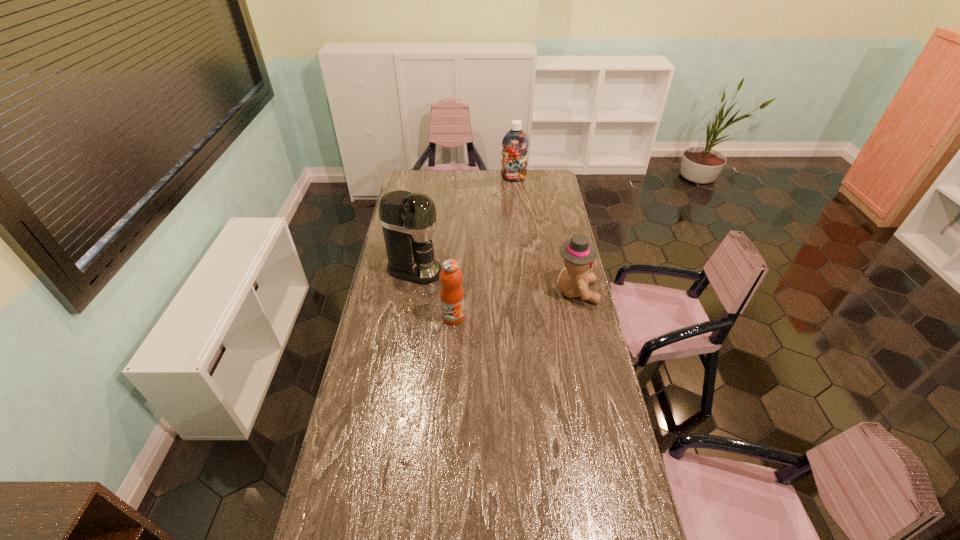
The width and height of the screenshot is (960, 540). Find the location of `object that is the second closest to the leftmost object`. object that is the second closest to the leftmost object is located at coordinates (579, 254).

What are the coordinates of `blank space that satisfies the following two spatial constraints: 1. on the front side of the rag_doll; 2. on the front-facing side of the third object from left to right` in the screenshot? It's located at (525, 292).